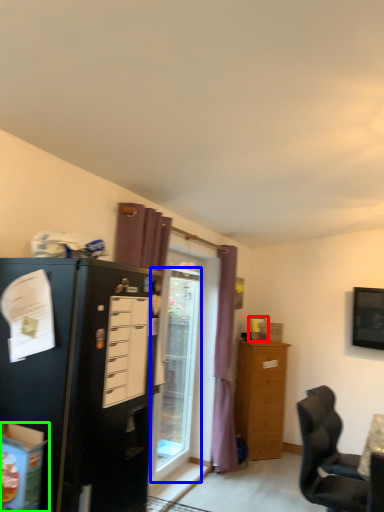
Question: Which is nearer to the picture frame (highlighted by a red box)? glass door (highlighted by a blue box) or box (highlighted by a green box).

Choices:
 (A) glass door
 (B) box

Answer: (A)